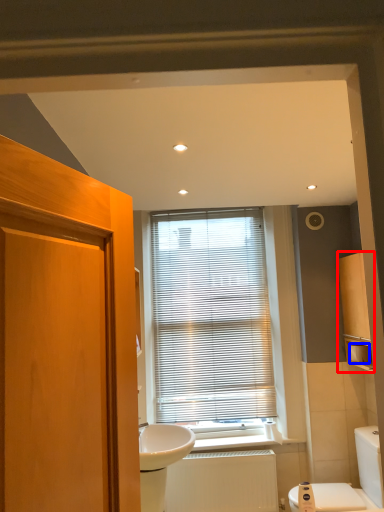
Question: Among these objects, which one is farthest to the camera, cabinetry (highlighted by a red box) or toilet paper (highlighted by a blue box)?

Choices:
 (A) cabinetry
 (B) toilet paper

Answer: (B)